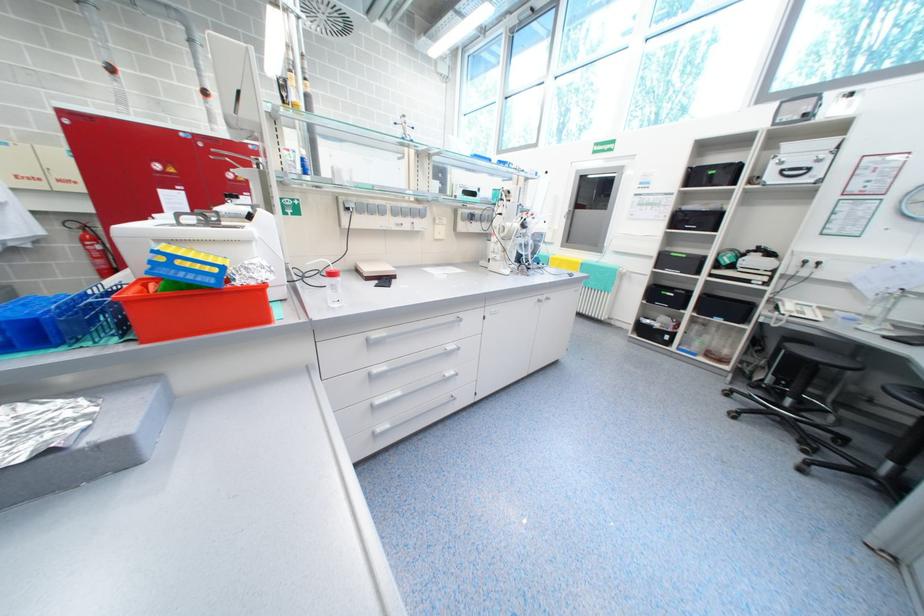
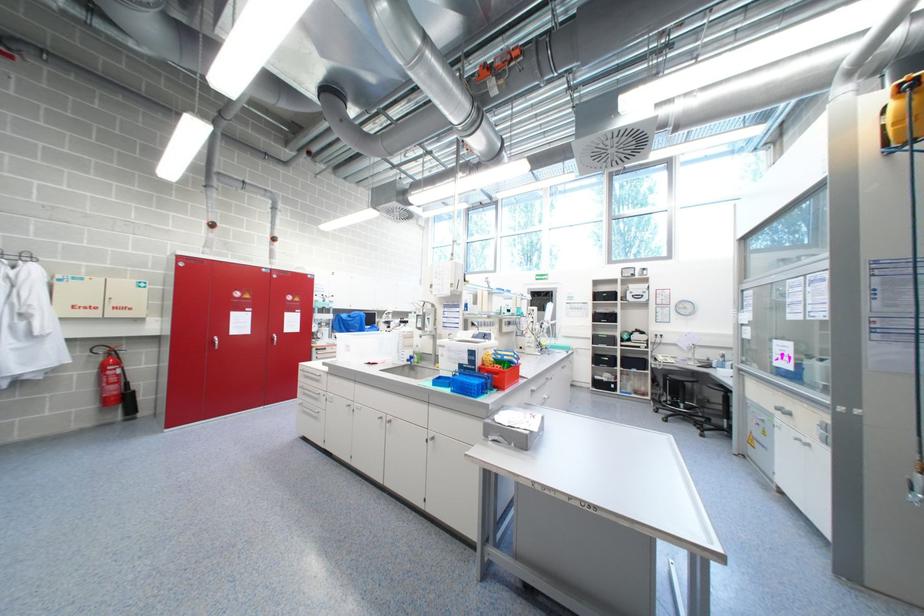
What movement of the cameraman would produce the second image?

The cameraman moved toward left, backward.